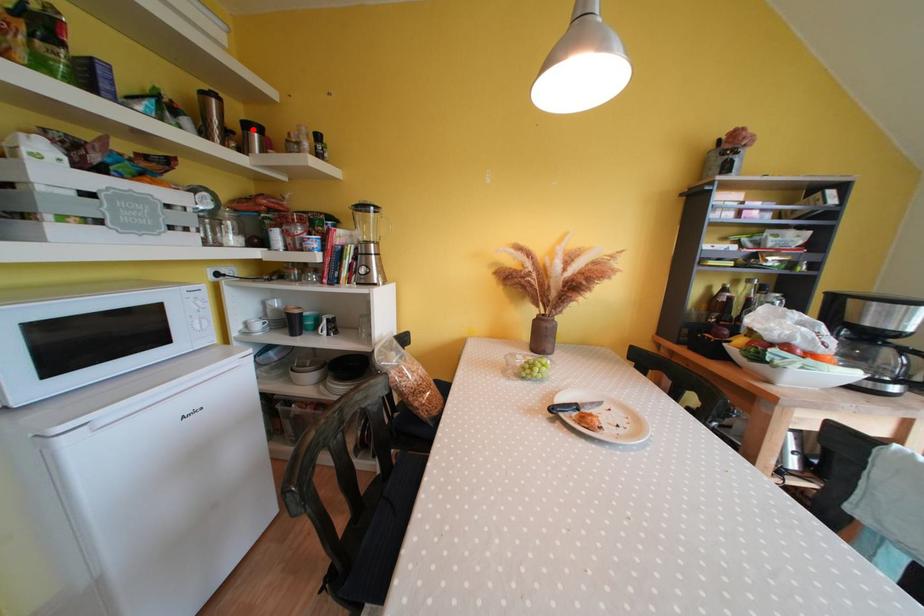
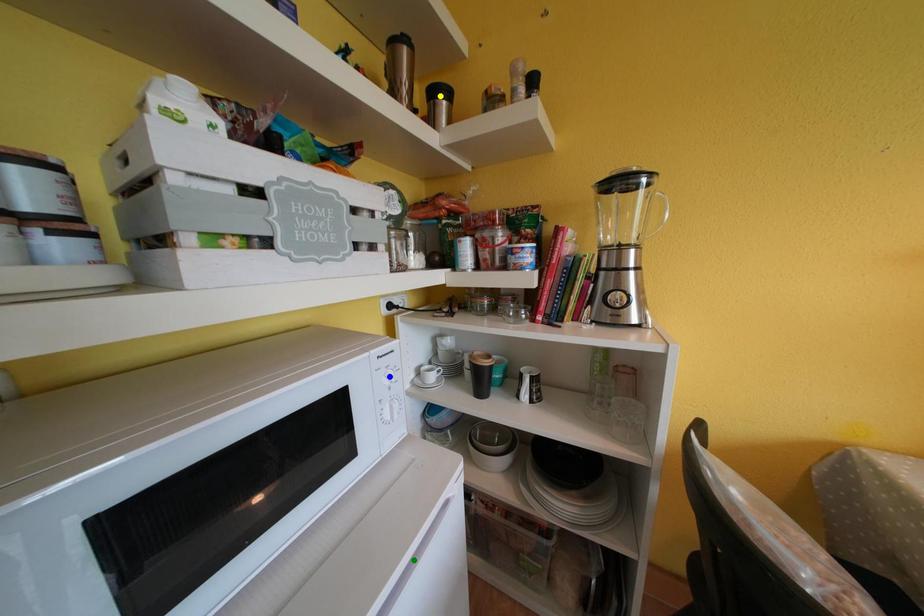
Question: I am providing you with two images of the same scene from different viewpoints. A red point is marked on the first image. You are given multiple points on the second image. Which point in image 2 is actually the same real-world point as the red point in image 1?

Choices:
 (A) green point
 (B) blue point
 (C) yellow point

Answer: (C)